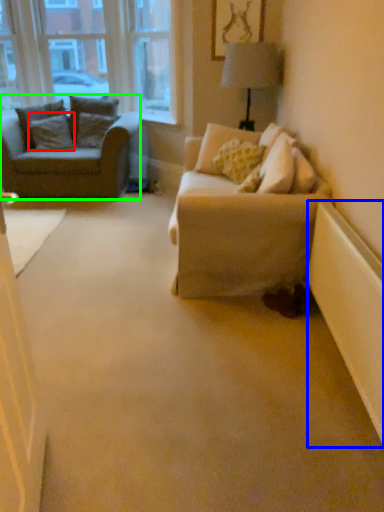
Question: Considering the real-world distances, which object is closest to pillow (highlighted by a red box)? radiator (highlighted by a blue box) or studio couch (highlighted by a green box).

Choices:
 (A) radiator
 (B) studio couch

Answer: (B)